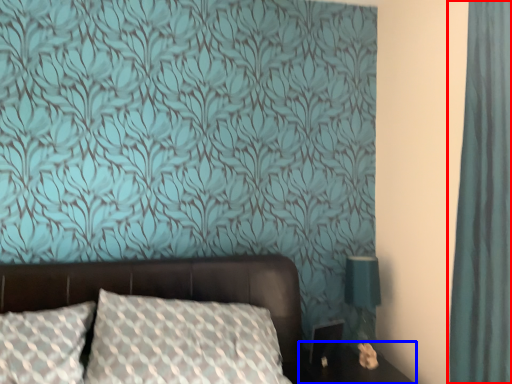
Question: Among these objects, which one is nearest to the camera, curtain (highlighted by a red box) or table (highlighted by a blue box)?

Choices:
 (A) curtain
 (B) table

Answer: (A)